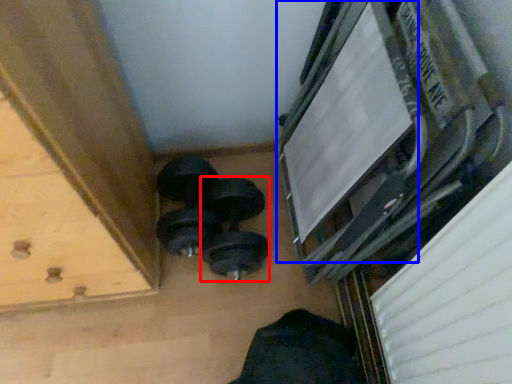
Question: Which object is further to the camera taking this photo, dumbbell (highlighted by a red box) or window frame (highlighted by a blue box)?

Choices:
 (A) dumbbell
 (B) window frame

Answer: (A)